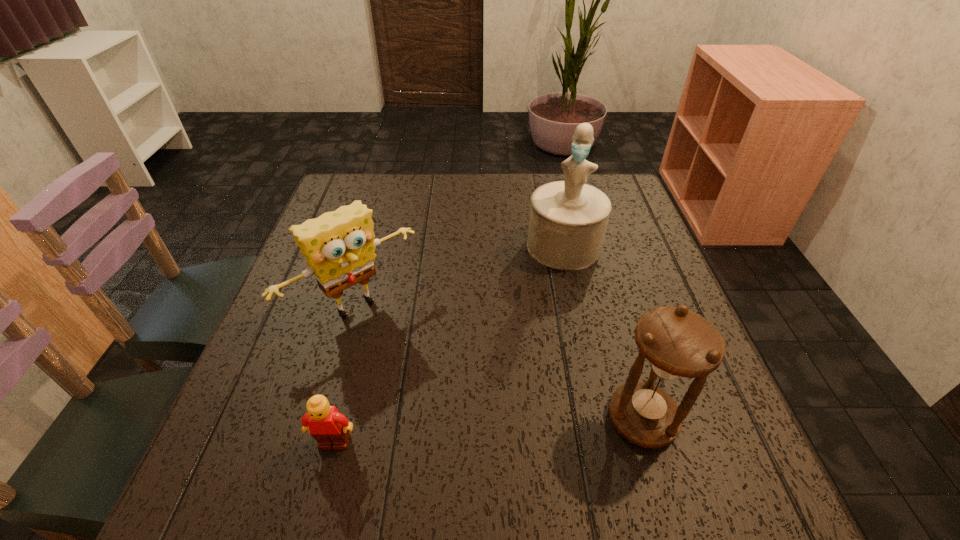
Where is `vacant space at the far edge of the desktop`? This screenshot has width=960, height=540. vacant space at the far edge of the desktop is located at coordinates (401, 184).

This screenshot has width=960, height=540. Find the location of `vacant area at the near edge of the desktop`. vacant area at the near edge of the desktop is located at coordinates (501, 410).

In the image, there is a desktop. Where is `blank space at the left edge`? blank space at the left edge is located at coordinates (317, 347).

What are the coordinates of `vacant space at the right edge of the desktop` in the screenshot? It's located at (614, 271).

Locate an element on the screen. The height and width of the screenshot is (540, 960). vacant region at the far left corner of the desktop is located at coordinates (374, 178).

Locate an element on the screen. The image size is (960, 540). free space at the near right corner of the desktop is located at coordinates (723, 422).

I want to click on unoccupied position between the second farthest object and the tallest object, so click(460, 276).

Where is `free space between the figurine and the hourglass`? This screenshot has width=960, height=540. free space between the figurine and the hourglass is located at coordinates (603, 332).

At what (x,y) coordinates should I click in order to perform the action: click on vacant space in between the Lego and the hourglass. Please return your answer as a coordinate pair (x, y). Looking at the image, I should click on (489, 430).

Where is `empty location between the figurine and the shortest object`? empty location between the figurine and the shortest object is located at coordinates (449, 344).